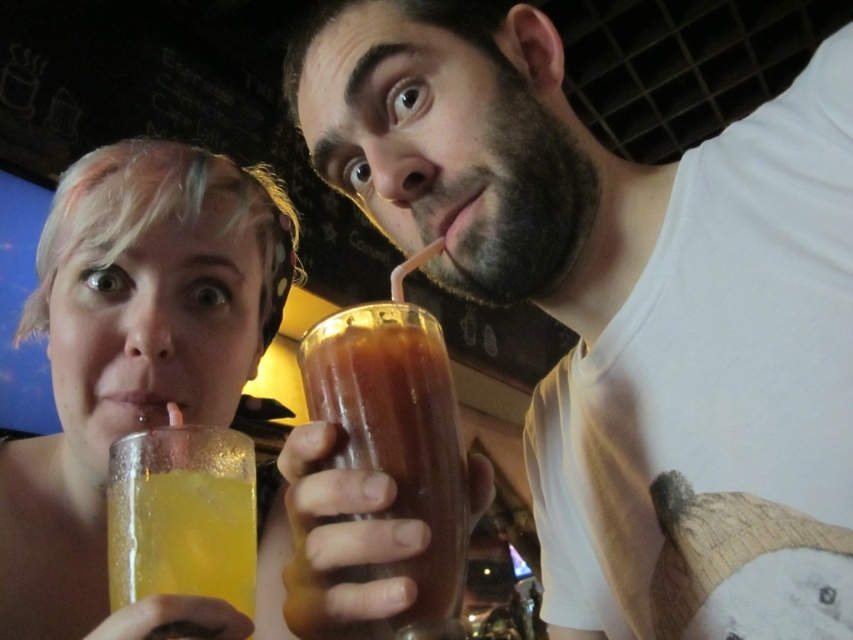
What are the coordinates of the matte plastic cup at upper center?

The coordinates of the matte plastic cup at upper center are at point (627, 308).

You are at a cafe and want to place a small napkin under your drink. The napkin is 5 cm wide. The point at coordinate (627,308) is on the matte plastic cup at upper center. Can you determine if the napkin will fit under the cup?

The point at coordinate (627,308) is on the matte plastic cup at upper center. Since the napkin is 5 cm wide, it should fit under the cup as long as the cup itself is wider than 5 cm. However, without knowing the exact dimensions of the cup, we cannot confirm for certain.

You are a delivery robot that needs to place a small package on the matte plastic cup at upper center. The package is 1.5 inches thick. Can you safely place it there without knocking over the cup?

The matte plastic cup at upper center is 17.55 inches away from the camera. Since the package is only 1.5 inches thick, it should be safe to place it there as the distance is sufficient to avoid knocking over the cup.